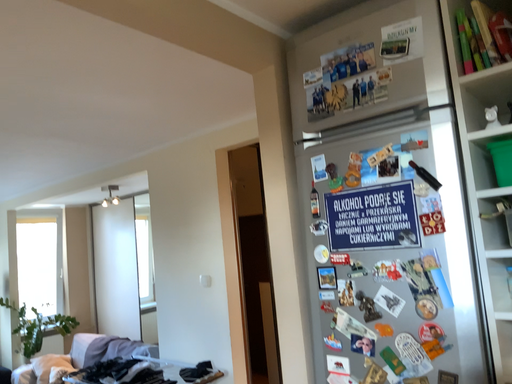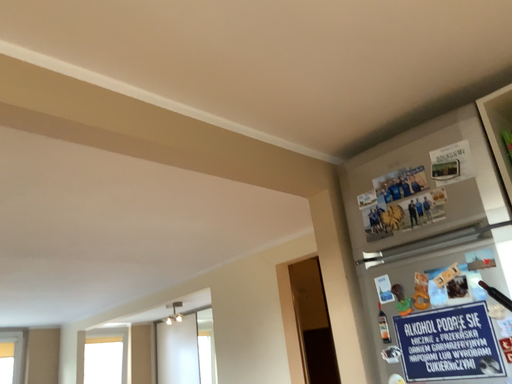
Question: Which way did the camera rotate in the video?

Choices:
 (A) rotated left
 (B) rotated right

Answer: (A)